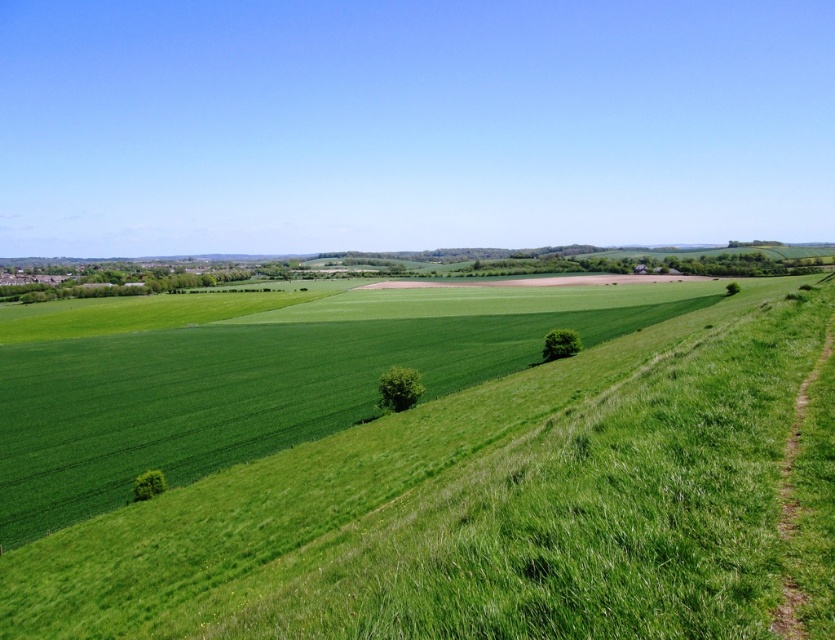
Who is shorter, green leafy tree at center or green leafy tree at lower left?

Standing shorter between the two is green leafy tree at lower left.

Does point (388, 388) come in front of point (134, 490)?

That is False.

Locate an element on the screen. green leafy tree at center is located at coordinates (398, 388).

Image resolution: width=835 pixels, height=640 pixels. What are the coordinates of `green leafy tree at center` in the screenshot? It's located at (398, 388).

Who is lower down, green leafy tree at lower right or green leafy tree at lower left?

Positioned lower is green leafy tree at lower left.

Looking at this image, is green leafy tree at lower right to the left of green leafy tree at lower left from the viewer's perspective?

In fact, green leafy tree at lower right is to the right of green leafy tree at lower left.

The height and width of the screenshot is (640, 835). I want to click on green leafy tree at lower right, so click(x=560, y=344).

Is point (393, 378) positioned before point (548, 332)?

Yes, it is in front of point (548, 332).

Is green leafy tree at center to the left of green leafy tree at lower right from the viewer's perspective?

Yes, green leafy tree at center is to the left of green leafy tree at lower right.

What do you see at coordinates (398, 388) in the screenshot?
I see `green leafy tree at center` at bounding box center [398, 388].

The image size is (835, 640). Find the location of `green leafy tree at center`. green leafy tree at center is located at coordinates (398, 388).